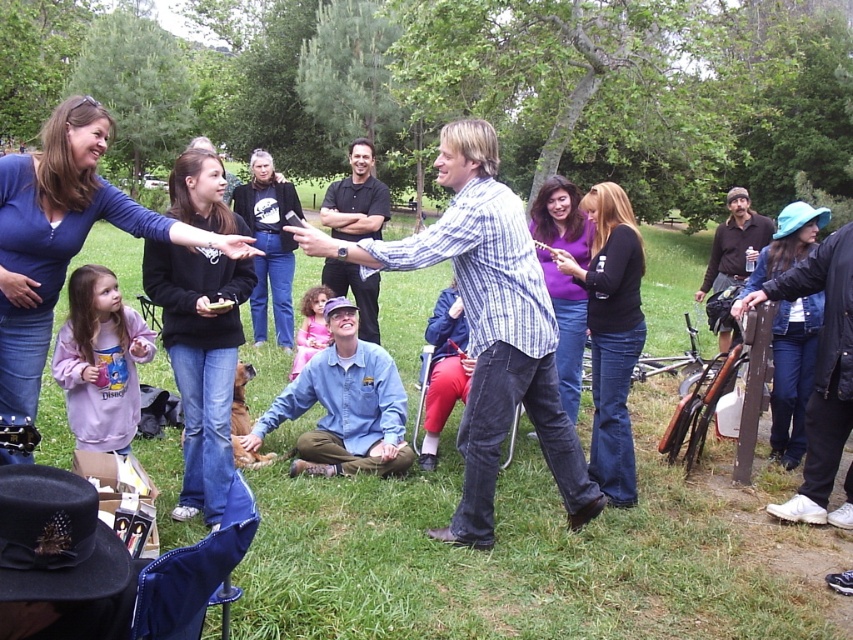
You are standing in the park and want to place a small picnic basket on the green grass at center. However, there is a brown leather jacket at right nearby. Based on their positions, can you determine if the jacket is blocking the grass where you want to place the basket?

The green grass at center is in front of the brown leather jacket at right, meaning the jacket is behind the grass. Therefore, the jacket is not blocking the grass where you want to place the basket.

You are planning to place a small picnic basket on the green grass at center and the brown leather jacket at right. Which location has enough space to accommodate the basket without overlapping other objects?

The green grass at center has a greater width than the brown leather jacket at right, so placing the picnic basket there would provide sufficient space without overlapping other objects.

You are standing in the park scene described. There is green grass at center and blue denim jeans at lower right. Which object is located higher up in the image?

The green grass at center is positioned higher up than the blue denim jeans at lower right.